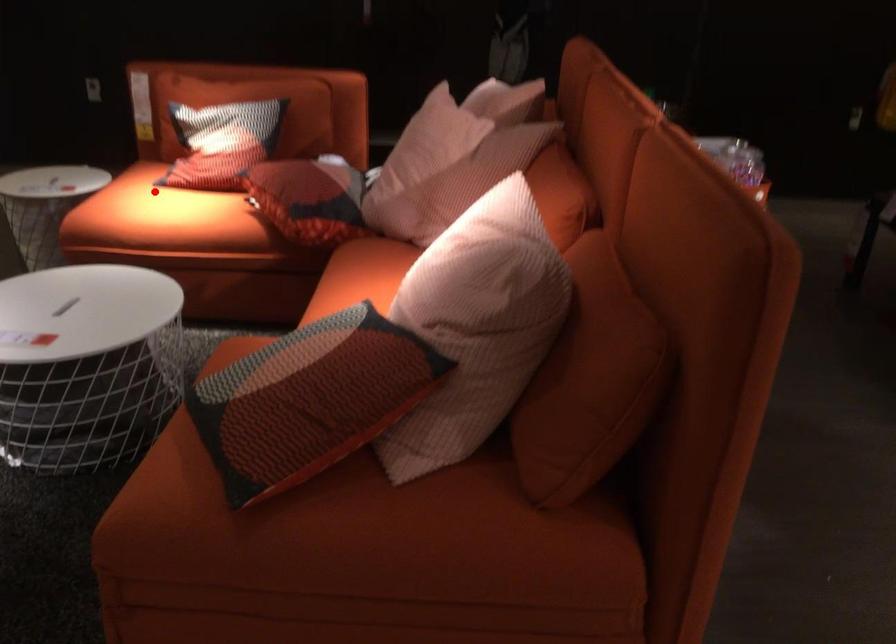
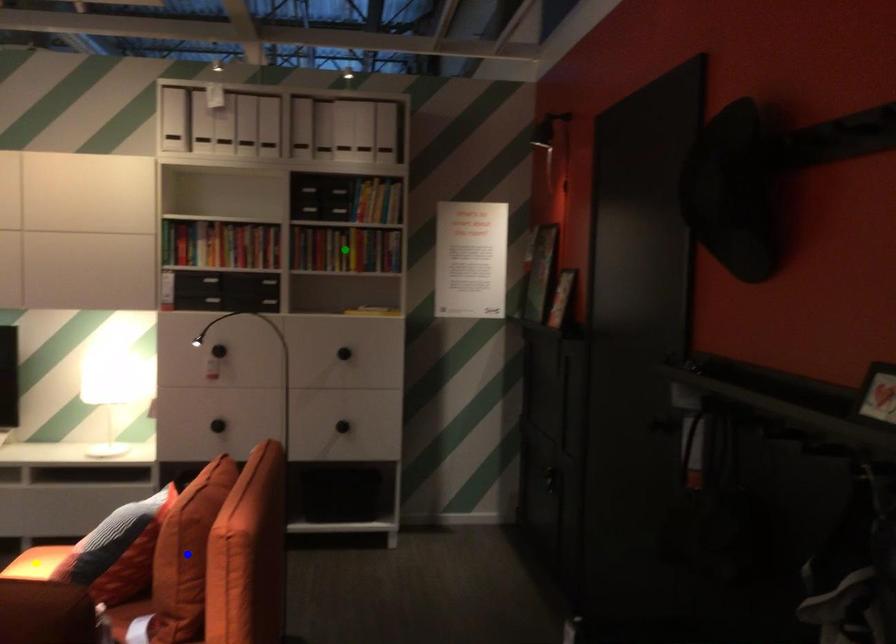
Question: I am providing you with two images of the same scene from different viewpoints. A red point is marked on the first image. You are given multiple points on the second image. Which point in image 2 represents the same 3d spot as the red point in image 1?

Choices:
 (A) green point
 (B) blue point
 (C) yellow point

Answer: (C)